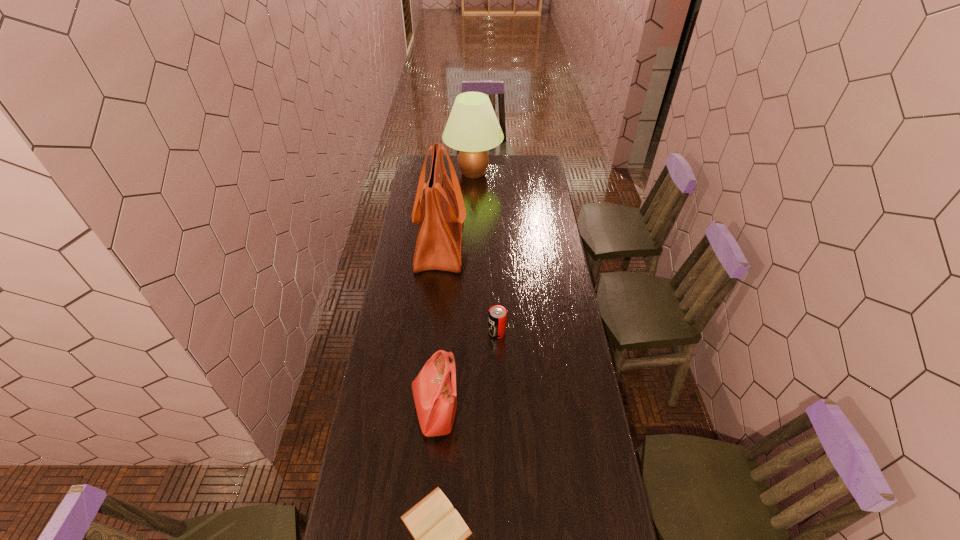
You are a GUI agent. You are given a task and a screenshot of the screen. Output one action in this format:
    pyautogui.click(x=<x>, y=<y>)
    Task: Click on the object that is at the far edge
    The image size is (960, 540).
    Given the screenshot: What is the action you would take?
    pyautogui.click(x=472, y=128)

The width and height of the screenshot is (960, 540). I want to click on object situated at the left edge, so [x=442, y=212].

Where is `vacant region at the far edge of the desktop`? The height and width of the screenshot is (540, 960). vacant region at the far edge of the desktop is located at coordinates (457, 159).

Find the location of a particular element. free region at the left edge of the desktop is located at coordinates (404, 252).

Identify the location of vacant region at the right edge of the desktop. This screenshot has height=540, width=960. (530, 237).

Identify the location of free region at the far left corner of the desktop. The image size is (960, 540). (425, 158).

Locate an element on the screen. vacant space in between the shopping bag and the can is located at coordinates (468, 287).

Locate an element on the screen. This screenshot has width=960, height=540. vacant area that lies between the second farthest object and the handbag is located at coordinates pos(438,326).

This screenshot has width=960, height=540. I want to click on vacant space in between the can and the farthest object, so click(485, 253).

At what (x,y) coordinates should I click in order to perform the action: click on unoccupied position between the shopping bag and the handbag. Please return your answer as a coordinate pair (x, y). Looking at the image, I should click on (438, 326).